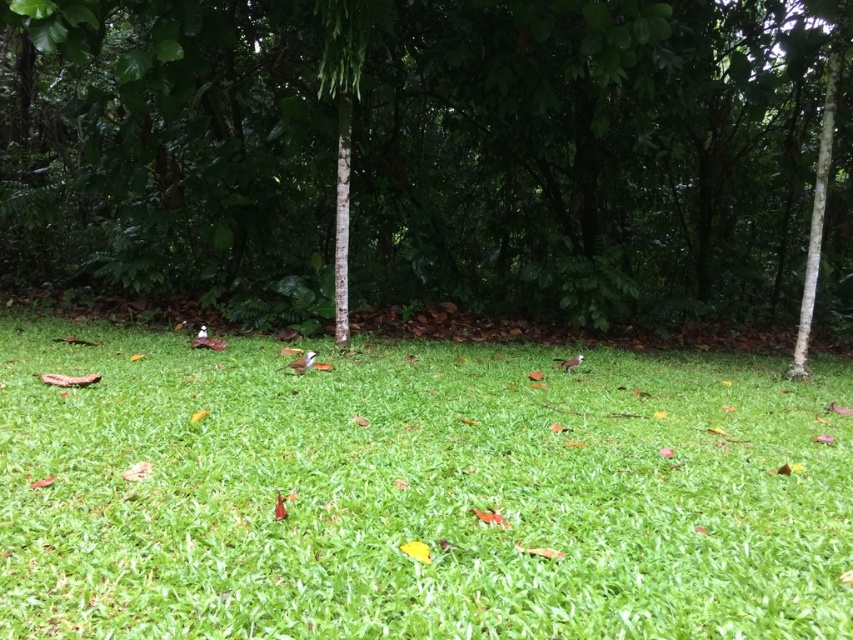
You are a gardener planning to plant a new tree in this area. Considering the green leafy tree at center and the green grass at center, which one occupies more space in the central part of the image?

The green leafy tree at center has a larger size compared to the green grass at center, so it occupies more space in the central part of the image.

You are standing at the edge of a grassy area and see a point marked at coordinates (444,148). Based on the scene description, what object is located at that point?

The point at coordinates (444,148) corresponds to the green leafy tree at center.